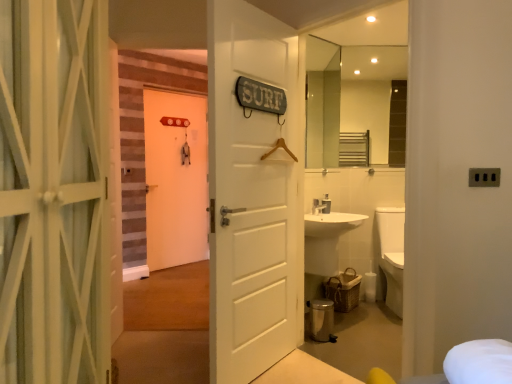
Question: Considering the relative positions of white matte door at center, which ranks as the 3th door in front-to-back order, and clear glass mirror at upper right, which ranks as the 1th mirror in left-to-right order, in the image provided, is white matte door at center, which ranks as the 3th door in front-to-back order, in front of clear glass mirror at upper right, which ranks as the 1th mirror in left-to-right order,?

Choices:
 (A) yes
 (B) no

Answer: (B)

Question: Can clear glass mirror at upper right, which ranks as the 1th mirror in left-to-right order, be found inside white matte door at center, which ranks as the 3th door in front-to-back order?

Choices:
 (A) yes
 (B) no

Answer: (B)

Question: Is white matte door at center, the first door when ordered from left to right, wider than clear glass mirror at upper right, which ranks as the 1th mirror in left-to-right order?

Choices:
 (A) no
 (B) yes

Answer: (B)

Question: Considering the relative sizes of white matte door at center, placed as the 3th door when sorted from right to left, and clear glass mirror at upper right, which ranks as the 1th mirror in left-to-right order, in the image provided, is white matte door at center, placed as the 3th door when sorted from right to left, shorter than clear glass mirror at upper right, which ranks as the 1th mirror in left-to-right order,?

Choices:
 (A) no
 (B) yes

Answer: (A)

Question: Could you tell me if white matte door at center, which ranks as the 3th door in front-to-back order, is facing clear glass mirror at upper right, which appears as the 2th mirror when viewed from the right?

Choices:
 (A) no
 (B) yes

Answer: (B)

Question: Does white matte door at center, which ranks as the 3th door in front-to-back order, appear on the left side of clear glass mirror at upper right, which appears as the 2th mirror when viewed from the right?

Choices:
 (A) yes
 (B) no

Answer: (A)

Question: Is white matte door at center, which is counted as the 1th door, starting from the back, looking in the opposite direction of white matte door at center, which ranks as the 3th door in left-to-right order?

Choices:
 (A) no
 (B) yes

Answer: (A)

Question: From a real-world perspective, is white matte door at center, which ranks as the 3th door in front-to-back order, beneath white matte door at center, the 1th door positioned from the right?

Choices:
 (A) yes
 (B) no

Answer: (B)

Question: Can you confirm if white matte door at center, the first door when ordered from left to right, is taller than white matte door at center, the 1th door positioned from the right?

Choices:
 (A) no
 (B) yes

Answer: (A)

Question: Does white matte door at center, which ranks as the 3th door in front-to-back order, turn towards white matte door at center, the 2th door from the front?

Choices:
 (A) yes
 (B) no

Answer: (B)

Question: Are white matte door at center, which is counted as the 1th door, starting from the back, and white matte door at center, the 1th door positioned from the right, located far from each other?

Choices:
 (A) no
 (B) yes

Answer: (B)

Question: From the image's perspective, is white matte door at center, which ranks as the 3th door in front-to-back order, above white matte door at center, the 2th door from the front?

Choices:
 (A) no
 (B) yes

Answer: (B)

Question: Does glossy glass mirror at upper center, which is the 2th mirror in left-to-right order, come in front of clear glass mirror at upper right, which appears as the 2th mirror when viewed from the right?

Choices:
 (A) no
 (B) yes

Answer: (A)